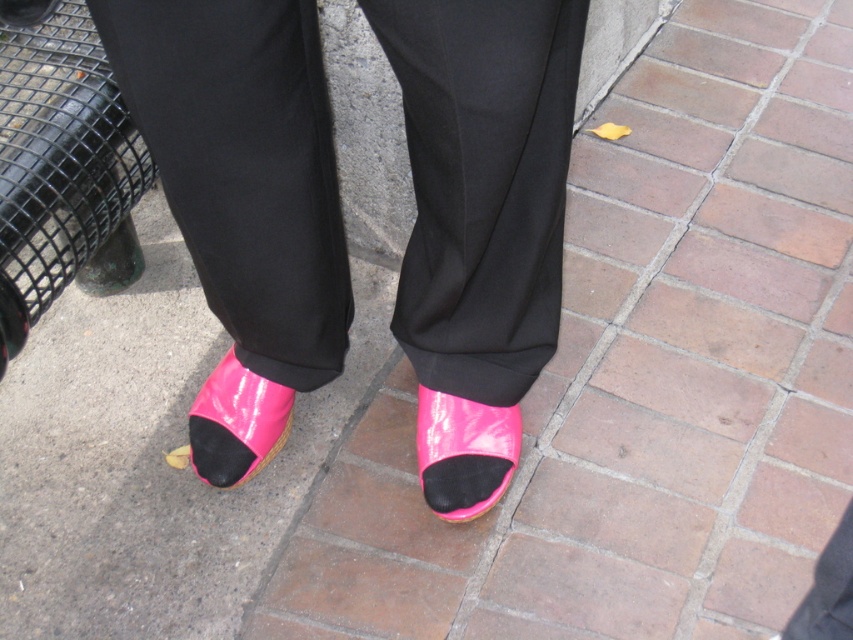
Between point (486, 140) and point (186, 464), which one is positioned behind?

Point (186, 464)

Is black smooth pants at center positioned behind matte black heel at lower center?

No, black smooth pants at center is in front of matte black heel at lower center.

In order to click on black smooth pants at center in this screenshot , I will do `click(482, 182)`.

This screenshot has width=853, height=640. In order to click on black smooth pants at center in this screenshot , I will do `click(482, 182)`.

Does black smooth pants at center have a larger size compared to pink glossy sandal at lower center?

Indeed, black smooth pants at center has a larger size compared to pink glossy sandal at lower center.

Can you confirm if black smooth pants at center is taller than pink glossy sandal at lower center?

Yes.

Which is in front, point (463, 56) or point (218, 385)?

Positioned in front is point (463, 56).

Where is `black smooth pants at center`? The image size is (853, 640). black smooth pants at center is located at coordinates (482, 182).

Which is behind, point (572, 81) or point (498, 452)?

Positioned behind is point (498, 452).

Does point (465, 16) lie in front of point (445, 515)?

Yes, point (465, 16) is in front of point (445, 515).

The height and width of the screenshot is (640, 853). What are the coordinates of `black smooth pants at center` in the screenshot? It's located at (482, 182).